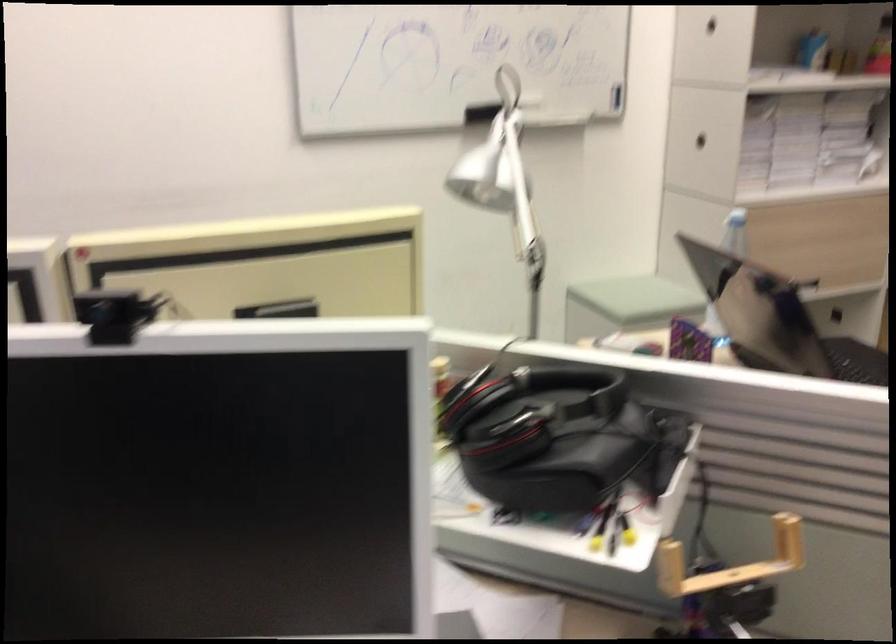
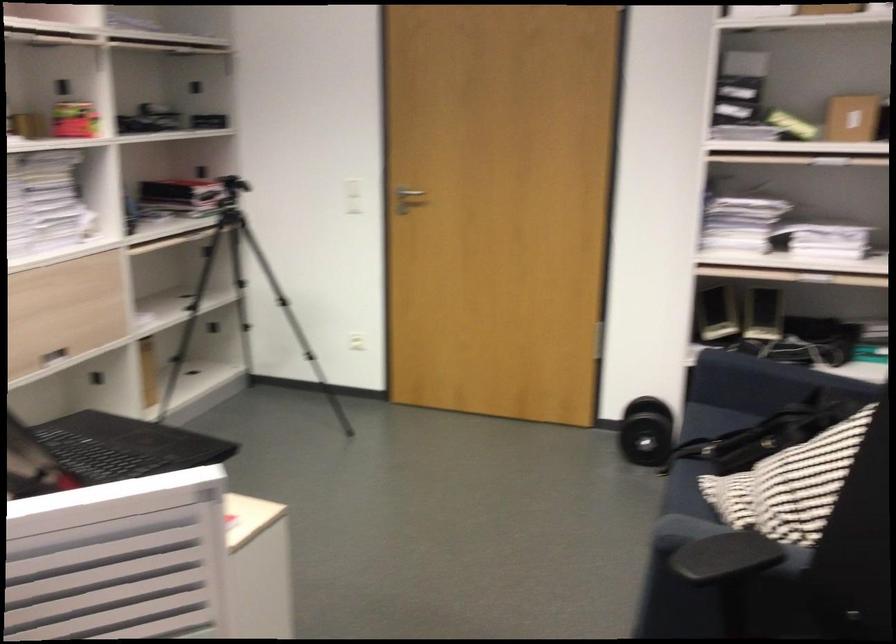
Question: How did the camera likely rotate?

Choices:
 (A) Left
 (B) Right
 (C) Up
 (D) Down

Answer: (B)